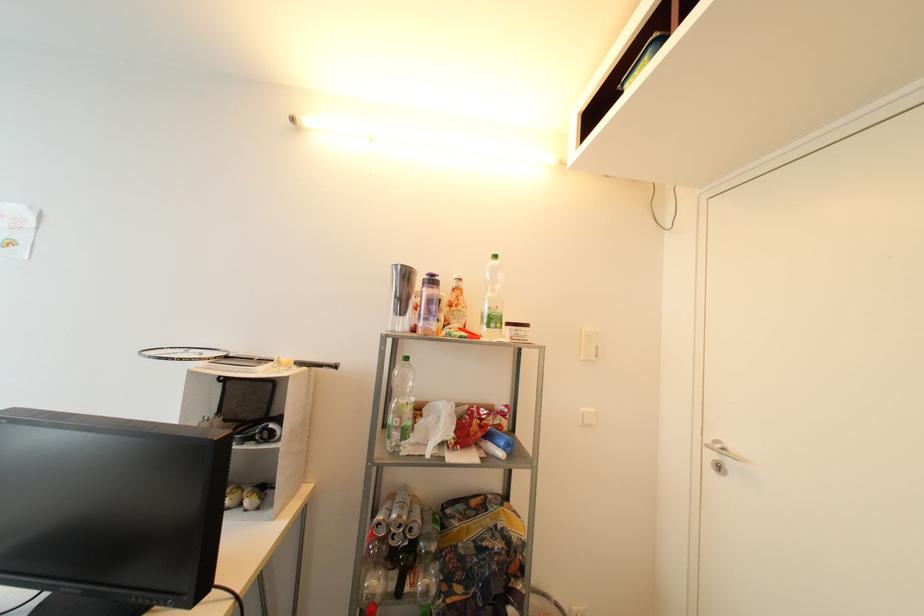
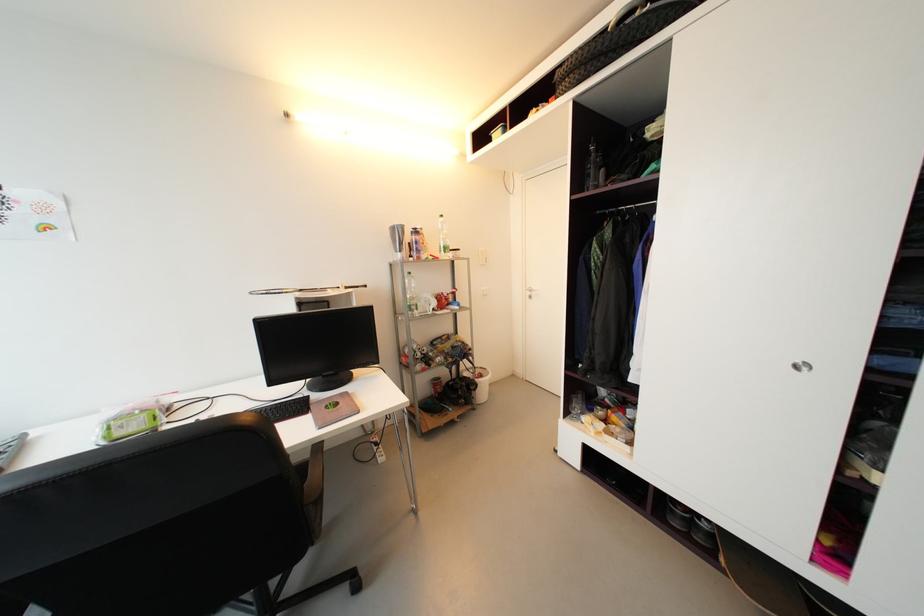
Locate, in the second image, the point that corresponds to (x=716, y=456) in the first image.

(533, 294)